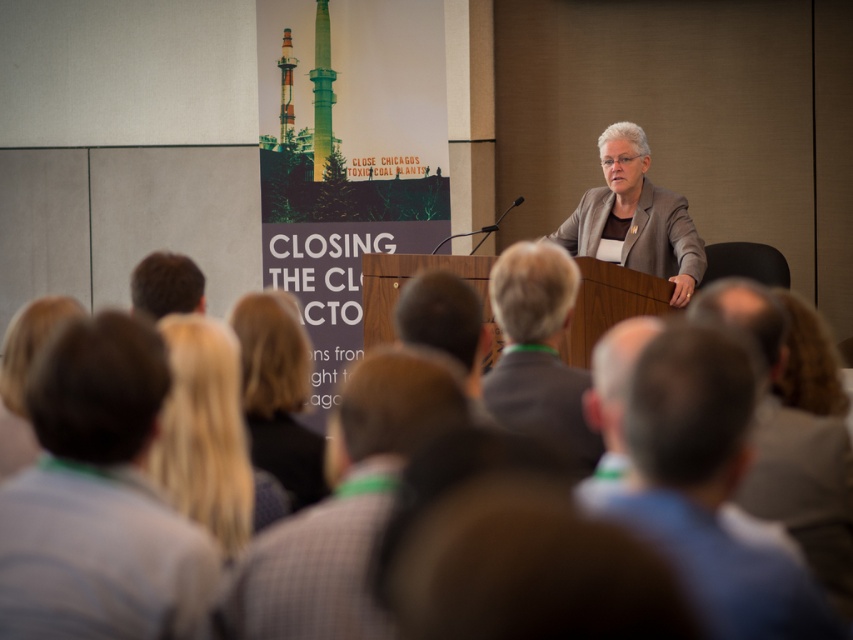
You are sitting in the front row of the presentation. You notice two points marked in the scene. The first point is at coordinates point (160, 467) and the second is at point (792, 332). Which point is closer to you?

Point (160, 467) is closer to the camera than point (792, 332), so the first point is closer to you.

You are an event organizer looking to seat VIP guests. You notice two individuals with blonde hair at center and blonde hair at lower right. Which of these two has a more prominent presence in the image?

The blonde hair at center has a larger size compared to the blonde hair at lower right, indicating a more prominent presence in the image.